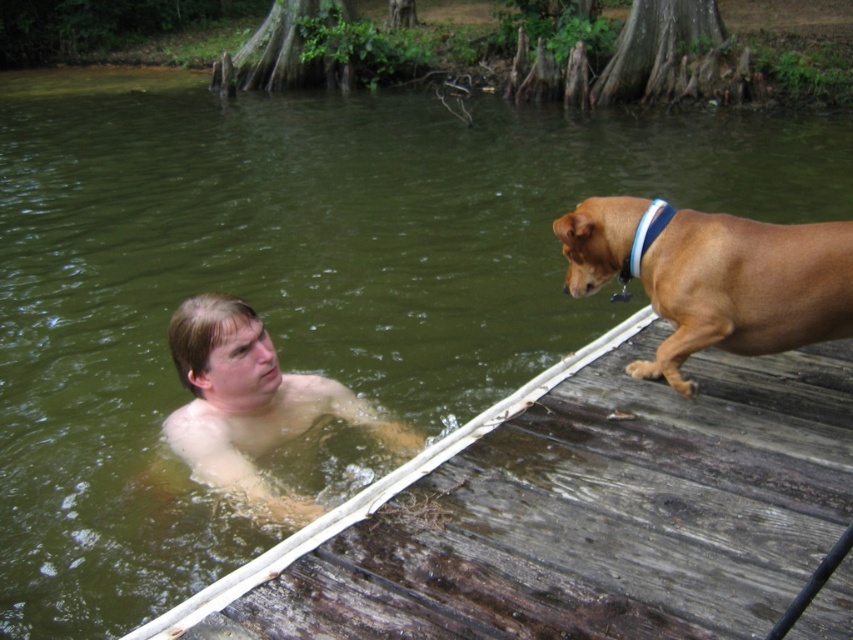
Question: Which object is closer to the camera taking this photo?

Choices:
 (A) pale skin/soft flesh man at upper center
 (B) brown smooth dog at right

Answer: (B)

Question: Which object is farther from the camera taking this photo?

Choices:
 (A) pale skin/soft flesh man at upper center
 (B) brown smooth dog at right
 (C) weathered wood dock at lower right

Answer: (A)

Question: Can you confirm if weathered wood dock at lower right is positioned to the left of pale skin/soft flesh man at upper center?

Choices:
 (A) yes
 (B) no

Answer: (B)

Question: Does weathered wood dock at lower right appear on the right side of brown smooth dog at right?

Choices:
 (A) yes
 (B) no

Answer: (B)

Question: Which point appears closest to the camera in this image?

Choices:
 (A) (773, 344)
 (B) (375, 413)

Answer: (A)

Question: In this image, where is weathered wood dock at lower right located relative to brown smooth dog at right?

Choices:
 (A) below
 (B) above

Answer: (A)